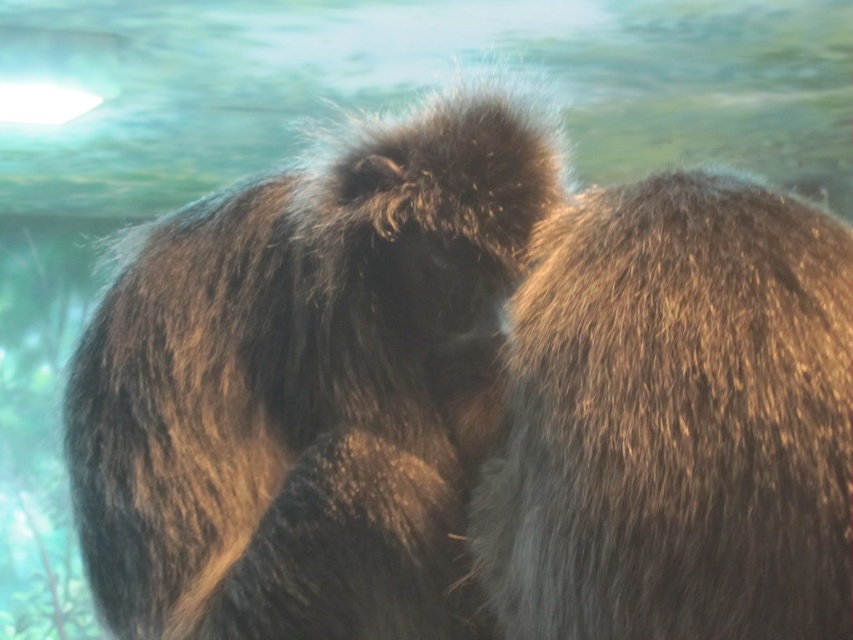
Is brown fuzzy fur at center taller than fuzzy brown fur at upper right?

Indeed, brown fuzzy fur at center has a greater height compared to fuzzy brown fur at upper right.

Can you confirm if brown fuzzy fur at center is positioned below fuzzy brown fur at upper right?

Yes.

You are a GUI agent. You are given a task and a screenshot of the screen. Output one action in this format:
    pyautogui.click(x=<x>, y=<y>)
    Task: Click on the brown fuzzy fur at center
    This screenshot has width=853, height=640.
    Given the screenshot: What is the action you would take?
    pyautogui.click(x=309, y=387)